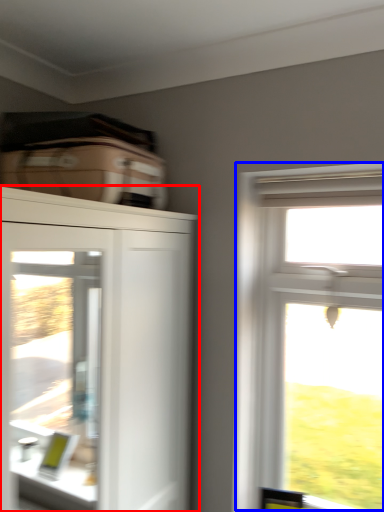
Question: Which point is further to the camera, cupboard (highlighted by a red box) or window (highlighted by a blue box)?

Choices:
 (A) cupboard
 (B) window

Answer: (B)